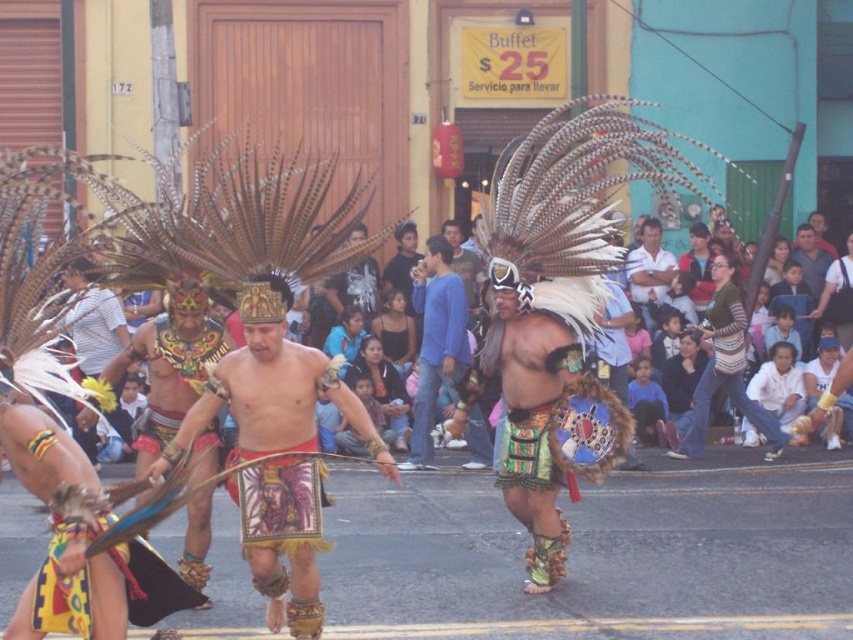
You are a photographer trying to capture the dancers in the center of the scene. You notice the matte gold headdress at center and the white shirt at center. Which object should you focus on first if you want to photograph the one that is on the left side?

The matte gold headdress at center is to the left of the white shirt at center, so you should focus on the matte gold headdress at center first.

You are a photographer standing in the crowd watching the dancers. You want to take a closeup photo of the matte gold headdress at center. Considering your camera can focus on objects within 30 feet, will you be able to capture a clear closeup?

The matte gold headdress at center is 31.07 feet from the viewer, which is beyond the camera focus range of 30 feet. Therefore, you won answer be able to capture a clear closeup.